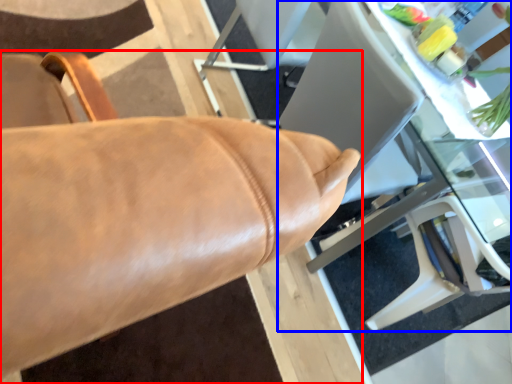
Question: Among these objects, which one is nearest to the camera, chair (highlighted by a red box) or table (highlighted by a blue box)?

Choices:
 (A) chair
 (B) table

Answer: (A)